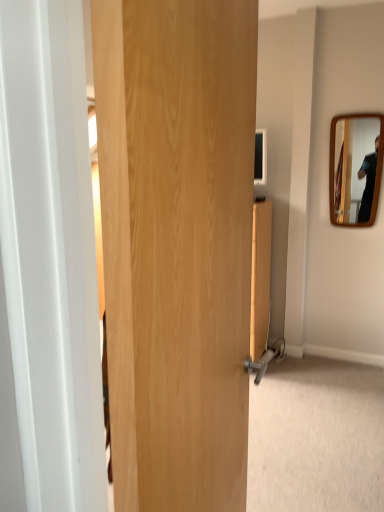
Question: In terms of width, does wooden mirror at right look wider or thinner when compared to wooden door at center?

Choices:
 (A) wide
 (B) thin

Answer: (B)

Question: Is point (380, 154) positioned closer to the camera than point (223, 59)?

Choices:
 (A) farther
 (B) closer

Answer: (A)

Question: From the image's perspective, is wooden mirror at right located above or below wooden door at center?

Choices:
 (A) above
 (B) below

Answer: (A)

Question: Would you say wooden door at center is to the left or to the right of wooden mirror at right in the picture?

Choices:
 (A) left
 (B) right

Answer: (A)

Question: Is wooden door at center in front of or behind wooden mirror at right in the image?

Choices:
 (A) front
 (B) behind

Answer: (A)

Question: Based on their sizes in the image, would you say wooden door at center is bigger or smaller than wooden mirror at right?

Choices:
 (A) small
 (B) big

Answer: (B)

Question: From a real-world perspective, is wooden door at center above or below wooden mirror at right?

Choices:
 (A) above
 (B) below

Answer: (B)